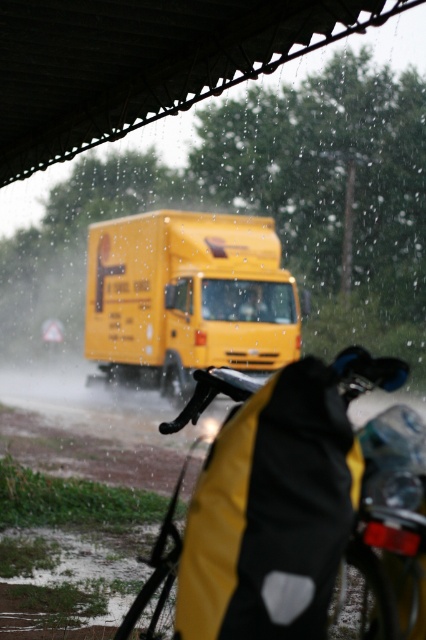
You are a pedestrian trying to cross the road. You see the yellow matte bag at lower center and the yellow matte truck at center. Which object is closer to you?

The yellow matte bag at lower center is closer to you because it is located below the yellow matte truck at center, which means it is positioned in front of the truck from your perspective.

You are a delivery person who needs to load a yellow matte bag at lower center into the yellow matte truck at center. Based on the scene, can the bag fit inside the truck bed?

The yellow matte bag at lower center is shorter than the yellow matte truck at center, so it should fit inside the truck bed as long as its other dimensions also accommodate.